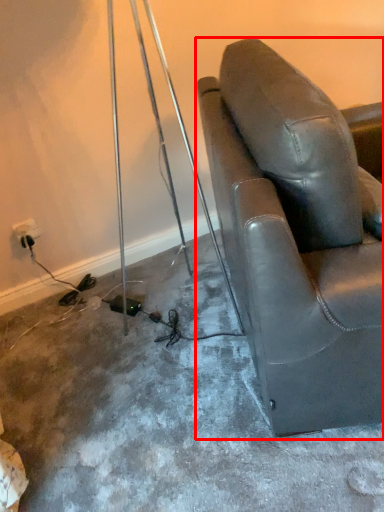
Question: From the image, what is the correct spatial relationship of chair (annotated by the red box) in relation to electric outlet?

Choices:
 (A) left
 (B) right

Answer: (B)